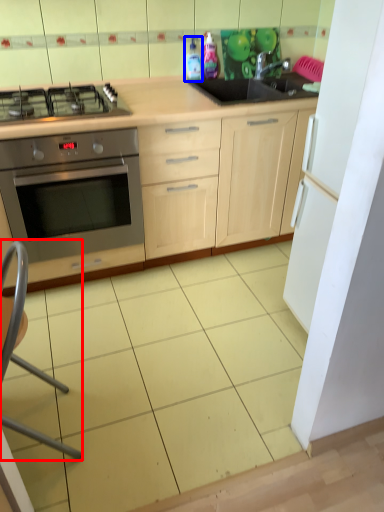
Question: Which object is further to the camera taking this photo, folding chair (highlighted by a red box) or bottle (highlighted by a blue box)?

Choices:
 (A) folding chair
 (B) bottle

Answer: (B)